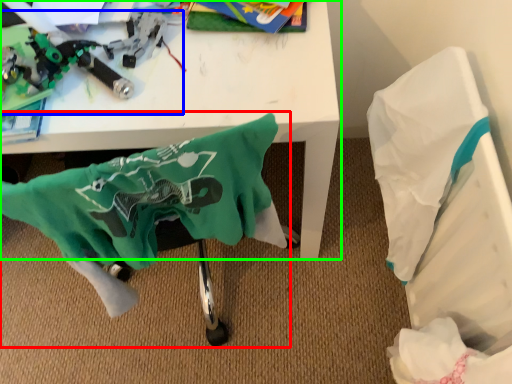
Question: Which object is positioned closest to swivel chair (highlighted by a red box)? Select from toy (highlighted by a blue box) and table (highlighted by a green box).

Choices:
 (A) toy
 (B) table

Answer: (B)